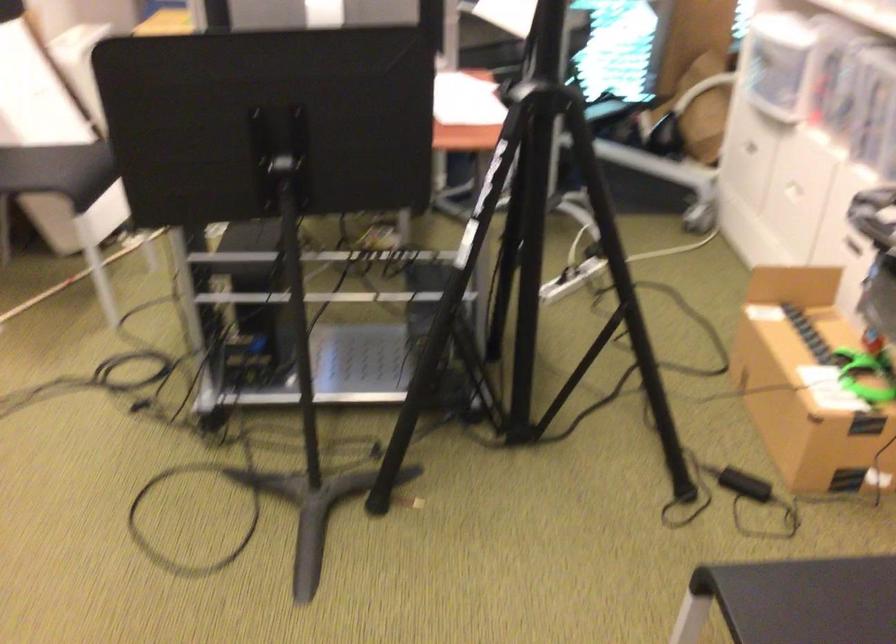
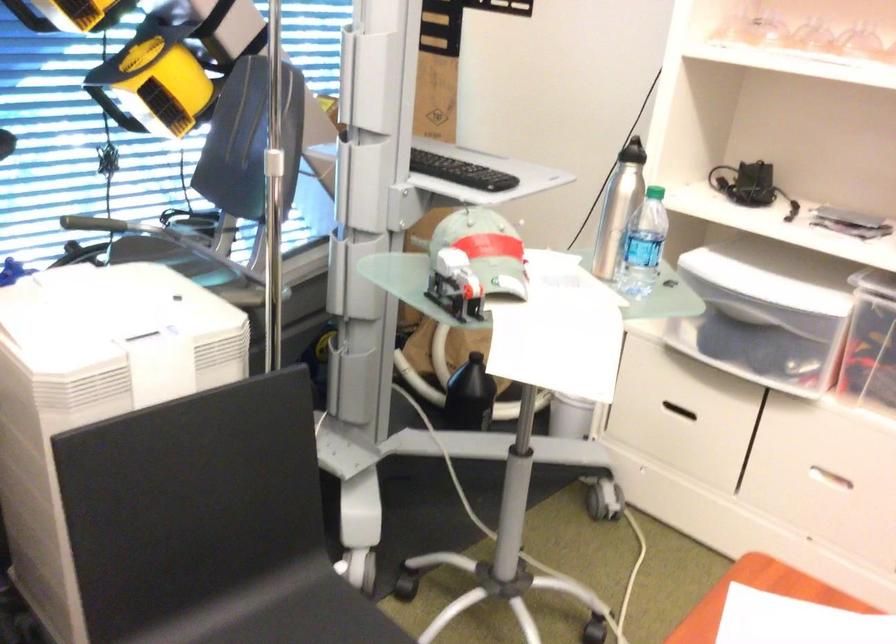
Locate, in the second image, the point that corresponds to the point at 733,135 in the first image.

(677, 411)